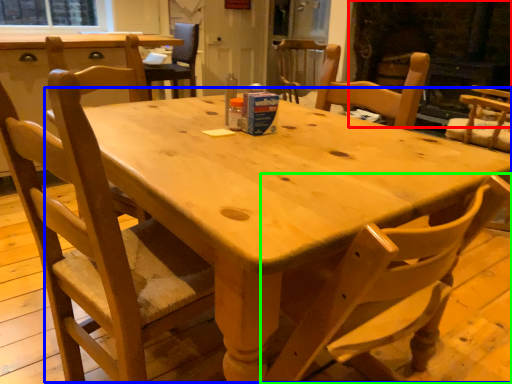
Question: Based on their relative distances, which object is nearer to fireplace (highlighted by a red box)? Choose from round table (highlighted by a blue box) and chair (highlighted by a green box).

Choices:
 (A) round table
 (B) chair

Answer: (A)